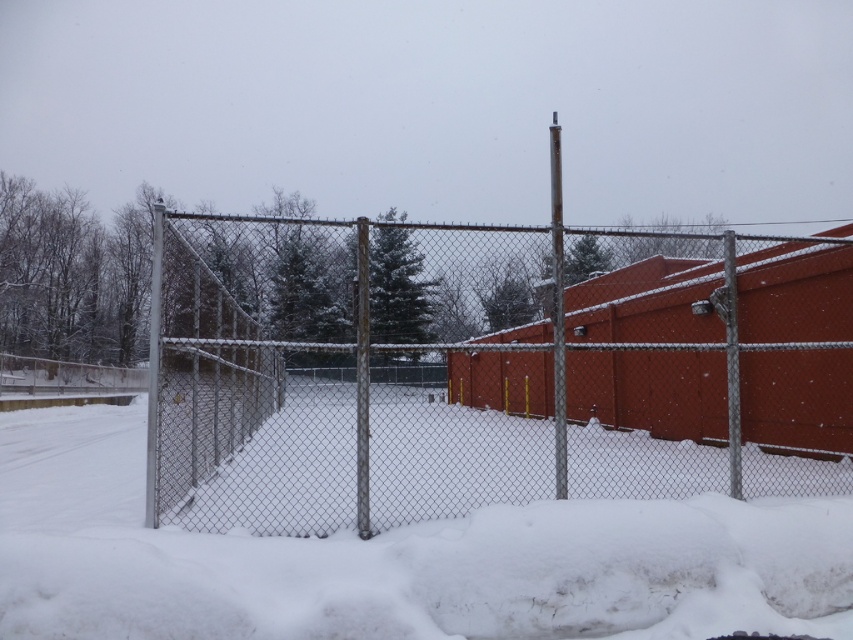
Is rusty chain-link fence at center taller than white fluffy snow at center?

Correct, rusty chain-link fence at center is much taller as white fluffy snow at center.

Which is behind, point (624, 330) or point (708, 593)?

Positioned behind is point (624, 330).

I want to click on rusty chain-link fence at center, so click(x=485, y=369).